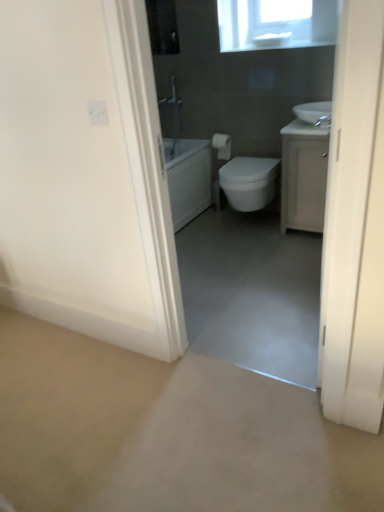
Question: Can you confirm if white matte toilet paper at center is smaller than smooth concrete floor at center?

Choices:
 (A) no
 (B) yes

Answer: (B)

Question: From a real-world perspective, is white matte toilet paper at center located beneath smooth concrete floor at center?

Choices:
 (A) yes
 (B) no

Answer: (B)

Question: Does white matte toilet paper at center have a greater width compared to smooth concrete floor at center?

Choices:
 (A) no
 (B) yes

Answer: (A)

Question: Considering the relative sizes of white matte toilet paper at center and smooth concrete floor at center in the image provided, is white matte toilet paper at center bigger than smooth concrete floor at center?

Choices:
 (A) yes
 (B) no

Answer: (B)

Question: From the image's perspective, does white matte toilet paper at center appear lower than smooth concrete floor at center?

Choices:
 (A) yes
 (B) no

Answer: (B)

Question: From the image's perspective, is white glossy sink at upper right above or below white glossy bidet at center?

Choices:
 (A) below
 (B) above

Answer: (B)

Question: Considering the positions of point 304,117 and point 238,198, is point 304,117 closer or farther from the camera than point 238,198?

Choices:
 (A) farther
 (B) closer

Answer: (B)

Question: Considering the positions of white glossy sink at upper right and white glossy bidet at center in the image, is white glossy sink at upper right wider or thinner than white glossy bidet at center?

Choices:
 (A) wide
 (B) thin

Answer: (B)

Question: Is white glossy sink at upper right spatially inside white glossy bidet at center, or outside of it?

Choices:
 (A) outside
 (B) inside

Answer: (A)

Question: Is smooth concrete floor at center wider or thinner than white glossy sink at upper right?

Choices:
 (A) wide
 (B) thin

Answer: (A)

Question: From a real-world perspective, relative to white glossy sink at upper right, is smooth concrete floor at center vertically above or below?

Choices:
 (A) below
 (B) above

Answer: (A)

Question: Based on their sizes in the image, would you say smooth concrete floor at center is bigger or smaller than white glossy sink at upper right?

Choices:
 (A) big
 (B) small

Answer: (A)

Question: From the image's perspective, relative to white glossy sink at upper right, is smooth concrete floor at center above or below?

Choices:
 (A) below
 (B) above

Answer: (A)

Question: Is smooth concrete floor at center bigger or smaller than white matte toilet paper at center?

Choices:
 (A) big
 (B) small

Answer: (A)

Question: Relative to white matte toilet paper at center, is smooth concrete floor at center in front or behind?

Choices:
 (A) front
 (B) behind

Answer: (A)